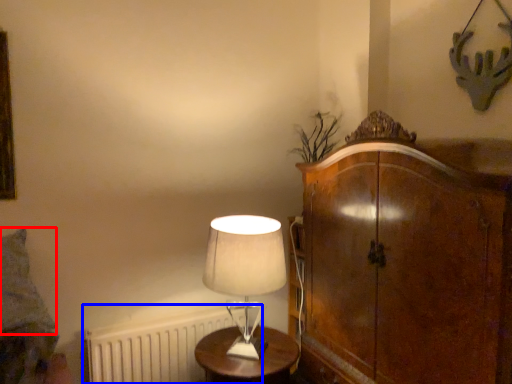
Question: Among these objects, which one is nearest to the camera, pillow (highlighted by a red box) or radiator (highlighted by a blue box)?

Choices:
 (A) pillow
 (B) radiator

Answer: (A)